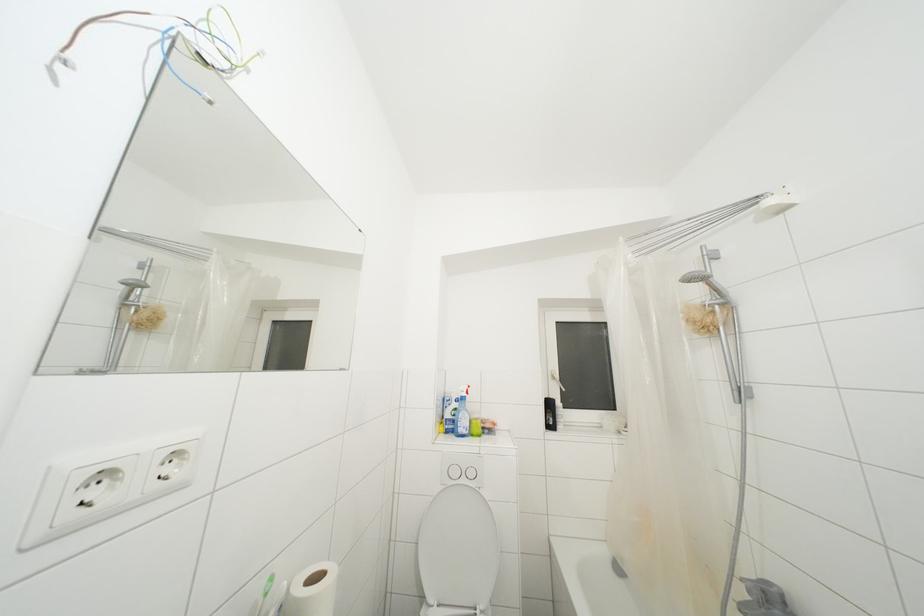
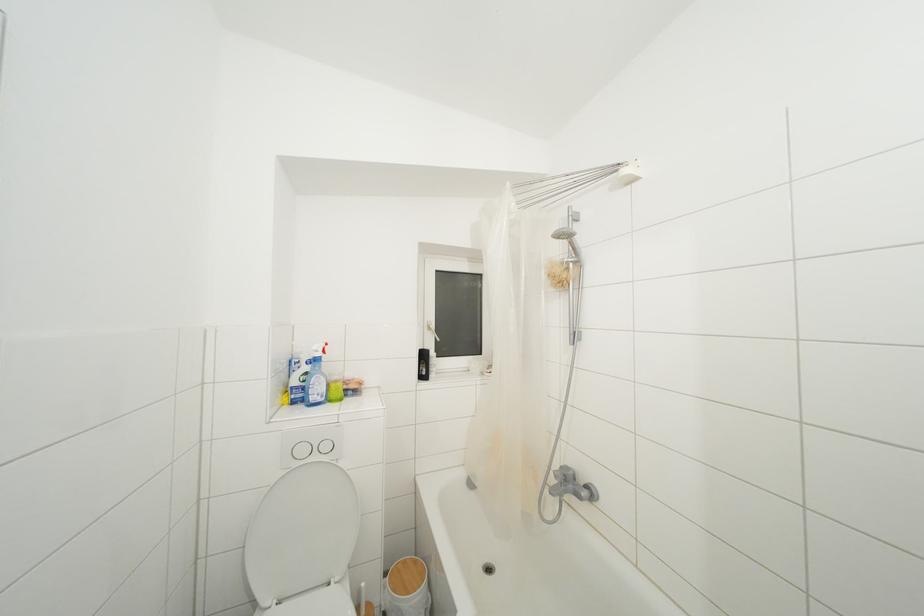
The point at (558, 383) is marked in the first image. Where is the corresponding point in the second image?

(433, 333)